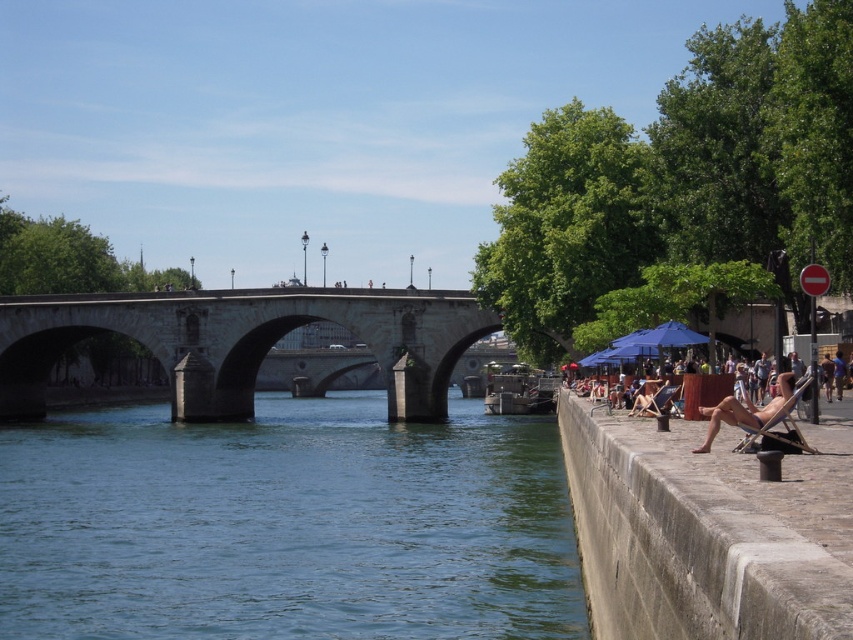
You are standing at the riverside and want to place a small potted plant between the concrete at right and the brown leather chair at right. Which object should the plant be closer to if you want it to be nearer to the viewer?

The concrete at right is closer to the viewer than the brown leather chair at right, so placing the plant closer to the concrete at right would make it nearer to the viewer.

You are standing at the center of the stone bridge on the left side of the image. Looking towards the right side of the image, you see a point marked at coordinates (x=700, y=536). What is the location of this point relative to the concrete embankment on the right?

The point at coordinates (x=700, y=536) corresponds to the concrete embankment on the right, so it is located on the concrete embankment.